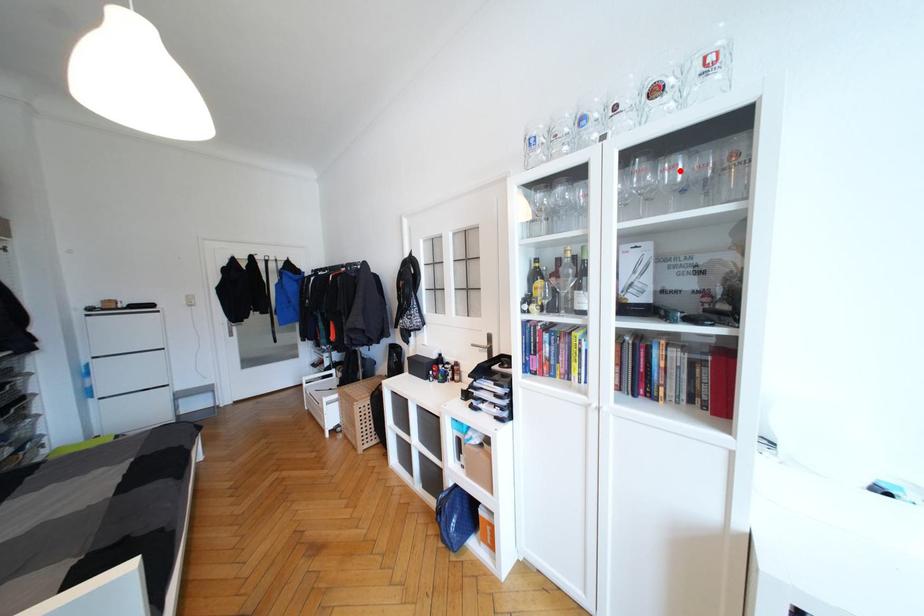
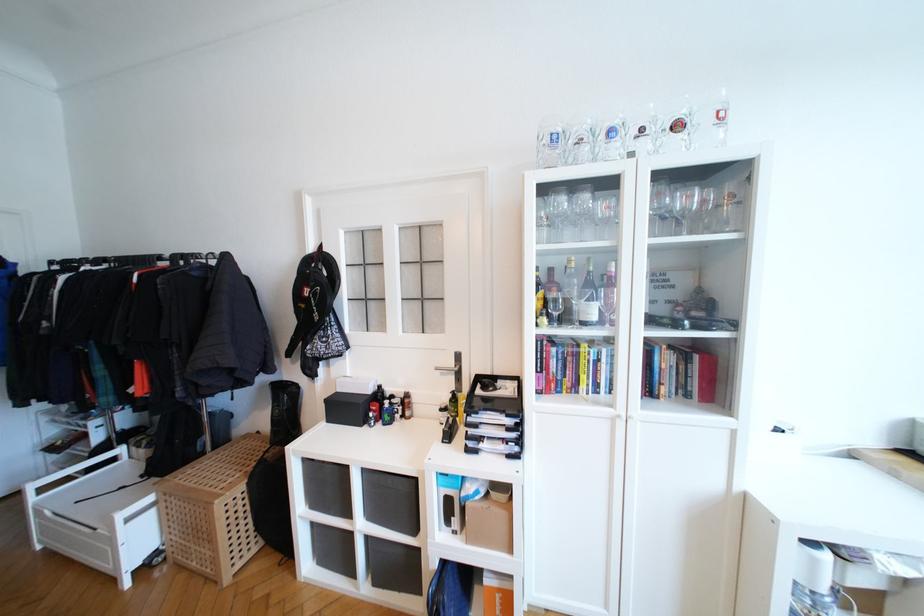
In the second image, find the point that corresponds to the highlighted location in the first image.

(691, 200)